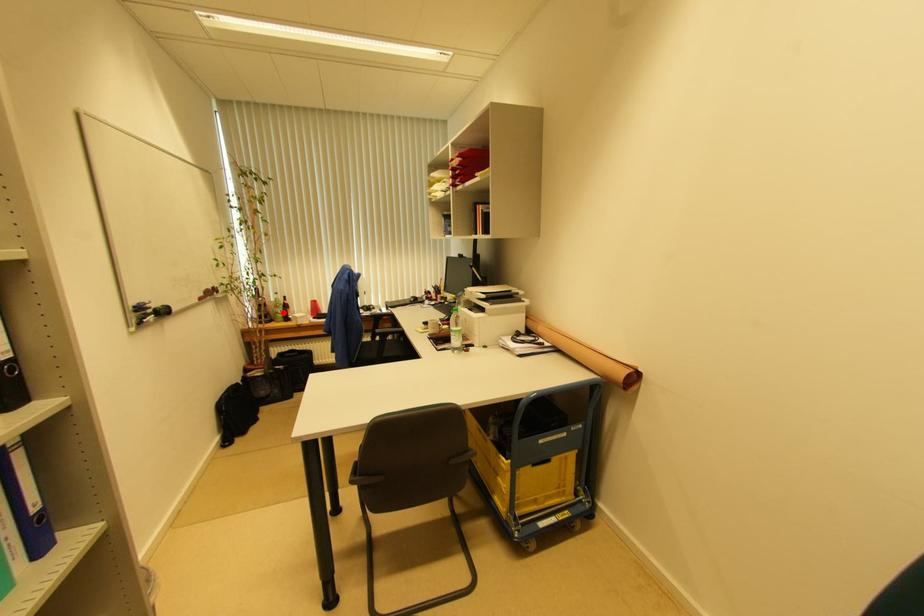
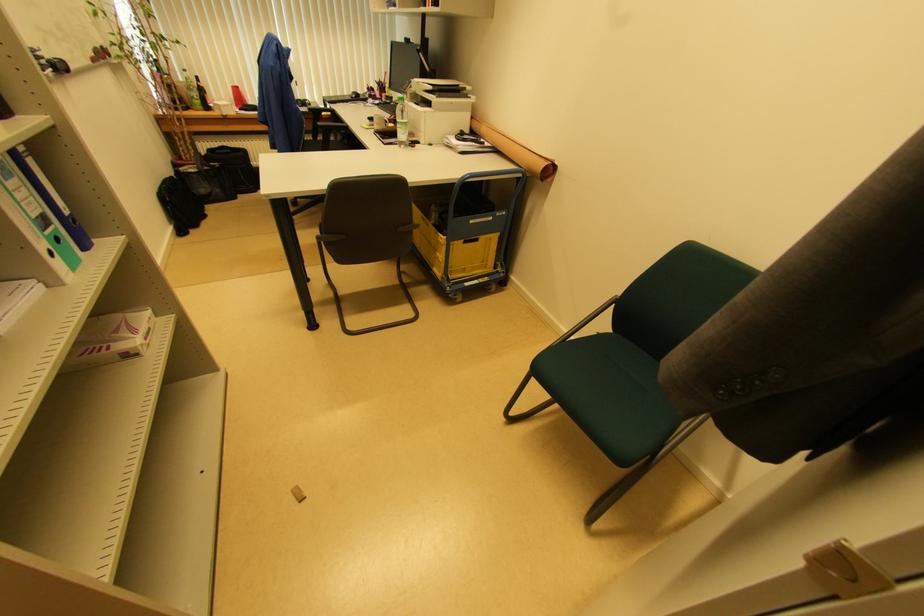
The point at the highlighted location is marked in the first image. Where is the corresponding point in the second image?

(200, 98)